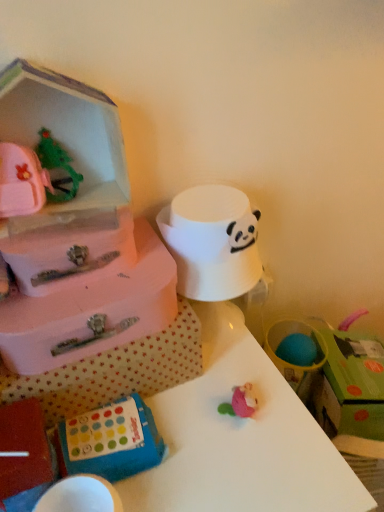
Question: Could you tell me if white glossy table at center is facing blue rubbery toy at lower center?

Choices:
 (A) yes
 (B) no

Answer: (B)

Question: Can you confirm if white glossy table at center is wider than blue rubbery toy at lower center?

Choices:
 (A) no
 (B) yes

Answer: (B)

Question: Is white glossy table at center smaller than blue rubbery toy at lower center?

Choices:
 (A) yes
 (B) no

Answer: (B)

Question: Can you confirm if white glossy table at center is positioned to the left of blue rubbery toy at lower center?

Choices:
 (A) no
 (B) yes

Answer: (A)

Question: Does white glossy table at center have a larger size compared to blue rubbery toy at lower center?

Choices:
 (A) yes
 (B) no

Answer: (A)

Question: From a real-world perspective, relative to blue rubbery toy at lower center, is green cardboard box at upper right vertically above or below?

Choices:
 (A) below
 (B) above

Answer: (A)

Question: Is green cardboard box at upper right spatially inside blue rubbery toy at lower center, or outside of it?

Choices:
 (A) outside
 (B) inside

Answer: (A)

Question: Is green cardboard box at upper right taller or shorter than blue rubbery toy at lower center?

Choices:
 (A) short
 (B) tall

Answer: (B)

Question: Considering their positions, is green cardboard box at upper right located in front of or behind blue rubbery toy at lower center?

Choices:
 (A) front
 (B) behind

Answer: (B)

Question: Do you think white glossy table at center is within blue rubbery toy at lower center, or outside of it?

Choices:
 (A) inside
 (B) outside

Answer: (B)

Question: Based on their sizes in the image, would you say white glossy table at center is bigger or smaller than blue rubbery toy at lower center?

Choices:
 (A) big
 (B) small

Answer: (A)

Question: Considering their positions, is white glossy table at center located in front of or behind blue rubbery toy at lower center?

Choices:
 (A) behind
 (B) front

Answer: (B)

Question: Looking at their shapes, would you say white glossy table at center is wider or thinner than blue rubbery toy at lower center?

Choices:
 (A) thin
 (B) wide

Answer: (B)

Question: Relative to green cardboard box at upper right, is white glossy table at center in front or behind?

Choices:
 (A) front
 (B) behind

Answer: (A)

Question: From their relative heights in the image, would you say white glossy table at center is taller or shorter than green cardboard box at upper right?

Choices:
 (A) short
 (B) tall

Answer: (B)